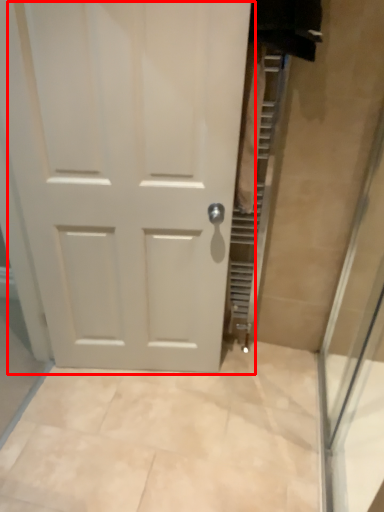
Question: Considering the relative positions of door (annotated by the red box) and shower door in the image provided, where is door (annotated by the red box) located with respect to the staircase?

Choices:
 (A) right
 (B) left

Answer: (B)